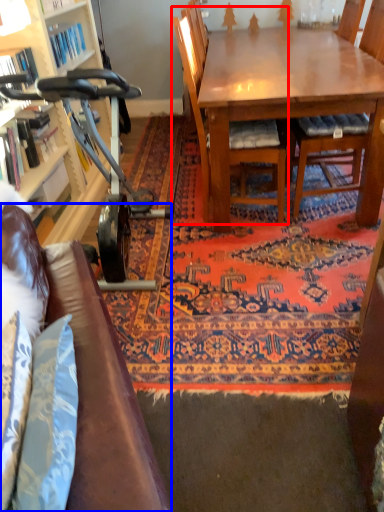
Question: Which point is further to the camera, chair (highlighted by a red box) or studio couch (highlighted by a blue box)?

Choices:
 (A) chair
 (B) studio couch

Answer: (A)